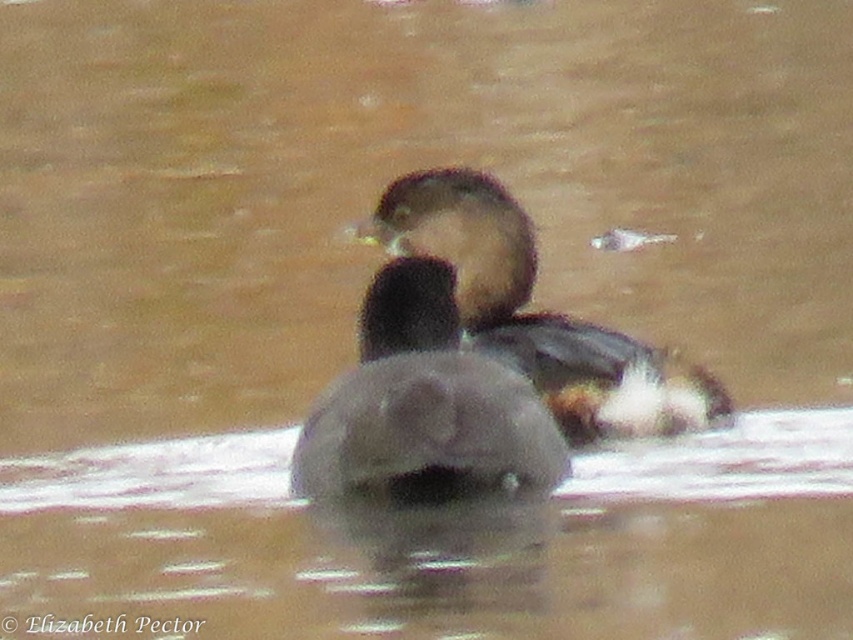
Is brown matte duck at center above brown speckled feathers at center?

Actually, brown matte duck at center is below brown speckled feathers at center.

Can you confirm if brown matte duck at center is bigger than brown speckled feathers at center?

Incorrect, brown matte duck at center is not larger than brown speckled feathers at center.

Is point (556, 481) positioned after point (486, 198)?

No, (556, 481) is closer to viewer.

The height and width of the screenshot is (640, 853). Find the location of `brown matte duck at center`. brown matte duck at center is located at coordinates [x=422, y=404].